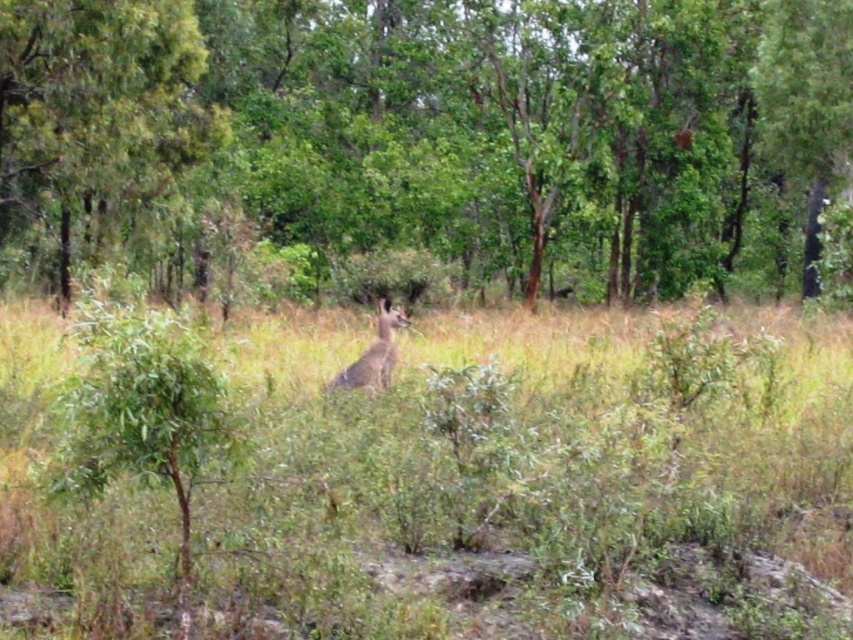
You are a hiker trying to navigate through the forest. You see a brown textured tree at center and a green leafy tree at upper left. Which tree would you choose to use as a landmark for navigation, and why?

You should choose the brown textured tree at center as a landmark because it is larger in size than the green leafy tree at upper left, making it more prominent and easier to identify from a distance.